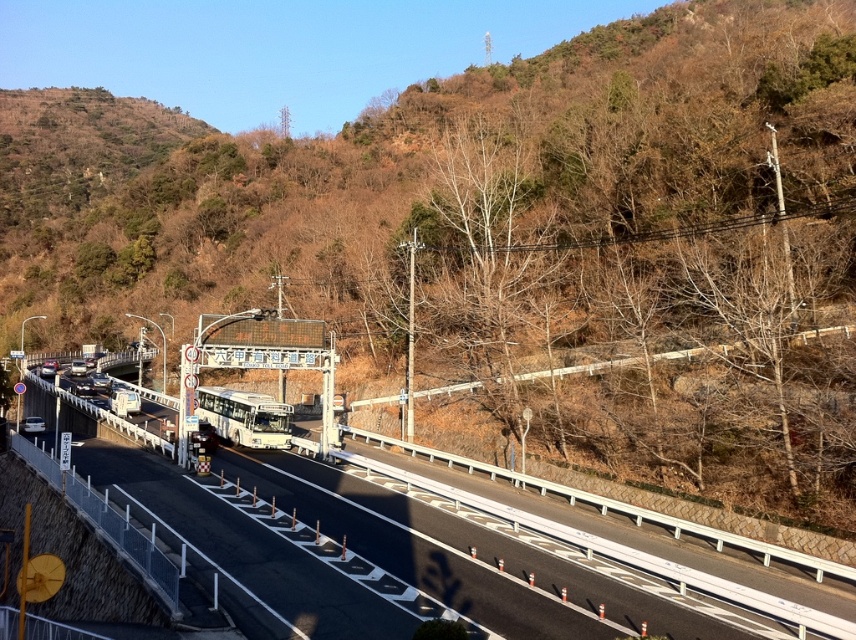
Looking at this image, you are a drone operator tasked with capturing aerial footage of the highway. The brown leafy hillside at upper center is an important landmark for your flight path. What are the coordinates of this landmark?

The brown leafy hillside at upper center is located at point (423, 170).

You are a driver approaching the highway and need to determine if there is enough space between the brown leafy hillside at upper center and the white matte bus at center for your vehicle to safely pass through. Can you confirm if the space between them is sufficient?

The brown leafy hillside at upper center is wider than the white matte bus at center, so the space between them should be sufficient for your vehicle to pass safely.